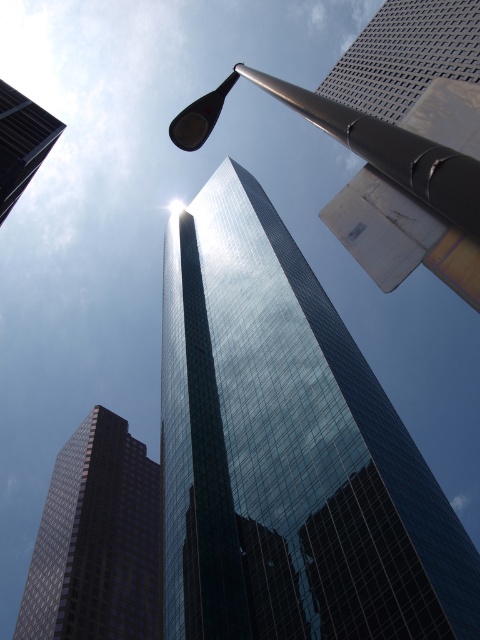
Which is more to the left, dark glass skyscraper at center or glassy reflective skyscraper at upper left?

dark glass skyscraper at center

Does point (86, 509) come farther from viewer compared to point (23, 180)?

Yes, point (86, 509) is farther from viewer.

The image size is (480, 640). In order to click on dark glass skyscraper at center in this screenshot , I will do `click(96, 540)`.

Does point (369, 154) come closer to viewer compared to point (12, 150)?

Yes.

Between polished metal pole at upper center and glassy reflective skyscraper at upper left, which one appears on the right side from the viewer's perspective?

polished metal pole at upper center is more to the right.

This screenshot has width=480, height=640. In order to click on polished metal pole at upper center in this screenshot , I will do `click(388, 177)`.

Is point (264, 300) positioned behind point (72, 456)?

No, (264, 300) is in front of (72, 456).

How far apart are glossy glass tower at center and dark glass skyscraper at center?

glossy glass tower at center is 172.02 feet away from dark glass skyscraper at center.

Is point (450, 561) closer to viewer compared to point (86, 566)?

That is True.

At what (x,y) coordinates should I click in order to perform the action: click on glossy glass tower at center. Please return your answer as a coordinate pair (x, y). Image resolution: width=480 pixels, height=640 pixels. Looking at the image, I should click on (288, 451).